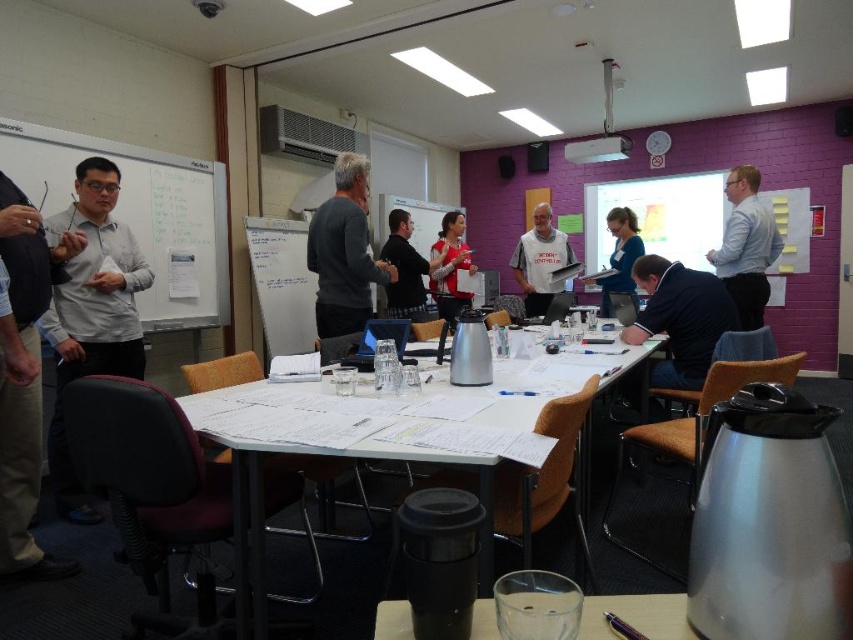
Is white shirt at left bigger than white paper at center?

No, white shirt at left is not bigger than white paper at center.

Can you confirm if white shirt at left is shorter than white paper at center?

Incorrect, white shirt at left's height does not fall short of white paper at center's.

Where is `white shirt at left`? This screenshot has height=640, width=853. white shirt at left is located at coordinates (91, 310).

Who is positioned more to the right, whiteboard at left or black shirt at center?

Positioned to the right is black shirt at center.

Is point (206, 218) positioned behind point (393, 225)?

No.

Based on the photo, measure the distance between point (196,196) and camera.

The distance of point (196,196) from camera is 4.14 meters.

Where is `whiteboard at left`? The image size is (853, 640). whiteboard at left is located at coordinates (140, 214).

Does point (143, 353) come closer to viewer compared to point (444, 244)?

Yes.

Who is more distant from viewer, (x=86, y=365) or (x=431, y=273)?

The point (x=431, y=273) is more distant.

You are a GUI agent. You are given a task and a screenshot of the screen. Output one action in this format:
    pyautogui.click(x=<x>, y=<y>)
    Task: Click on the white shirt at left
    
    Given the screenshot: What is the action you would take?
    pyautogui.click(x=91, y=310)